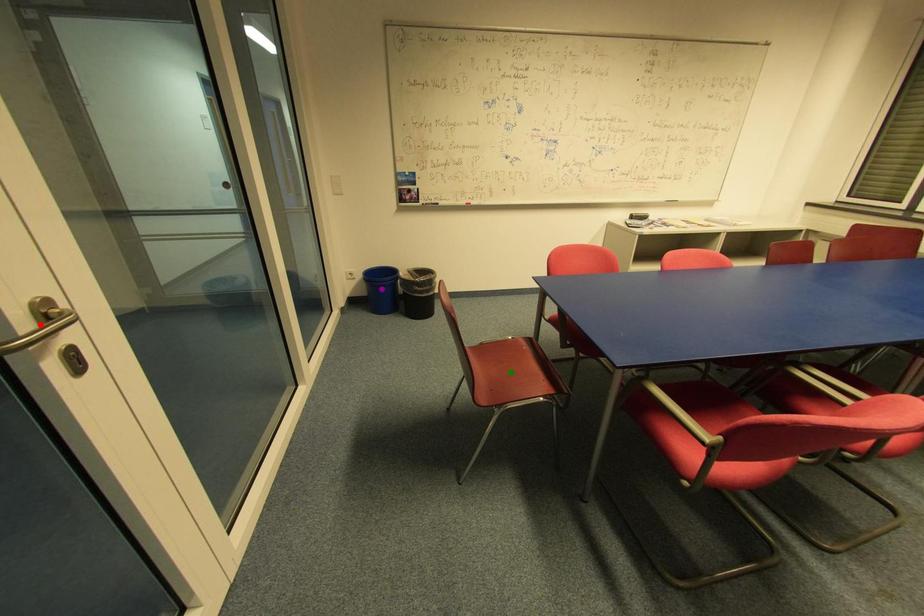
From the picture: Order these from nearest to farthest:
A) purple point
B) red point
C) green point

red point
green point
purple point